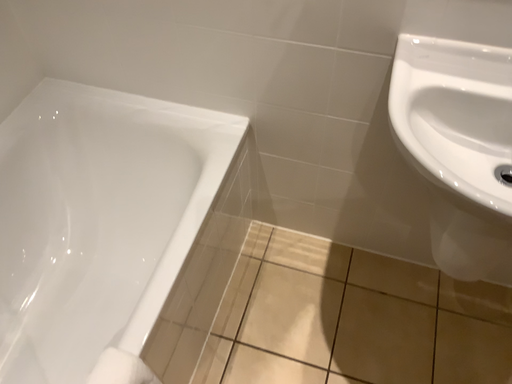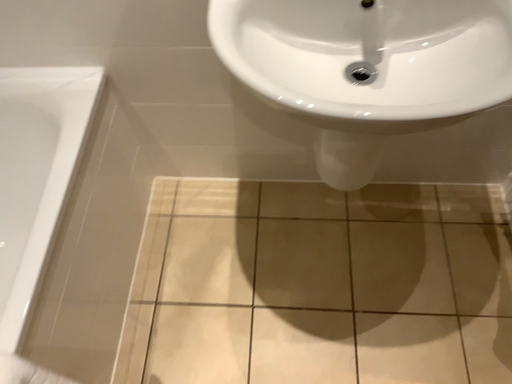
Question: Which way did the camera rotate in the video?

Choices:
 (A) rotated upward
 (B) rotated downward

Answer: (B)